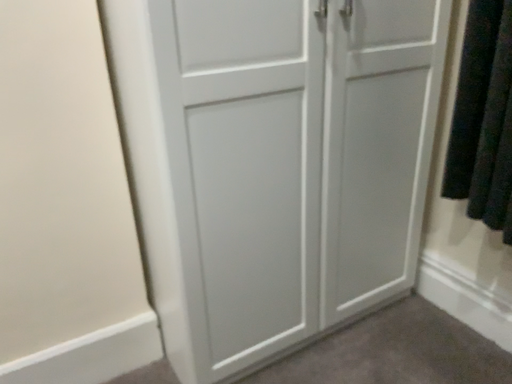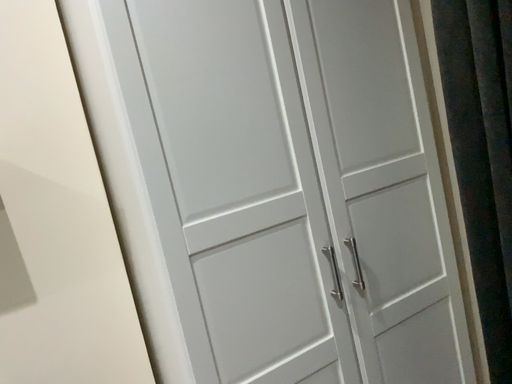
Question: Which way did the camera rotate in the video?

Choices:
 (A) rotated downward
 (B) rotated upward

Answer: (B)